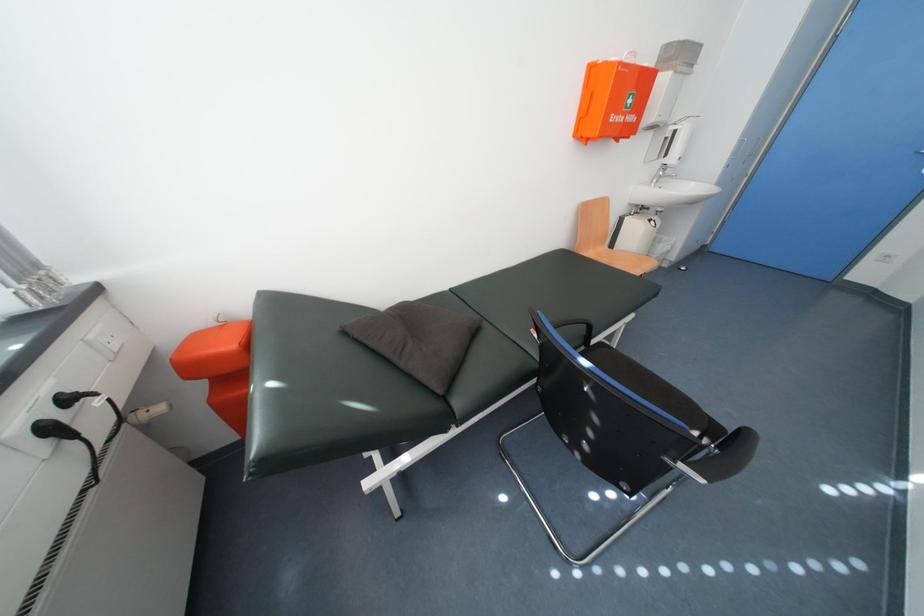
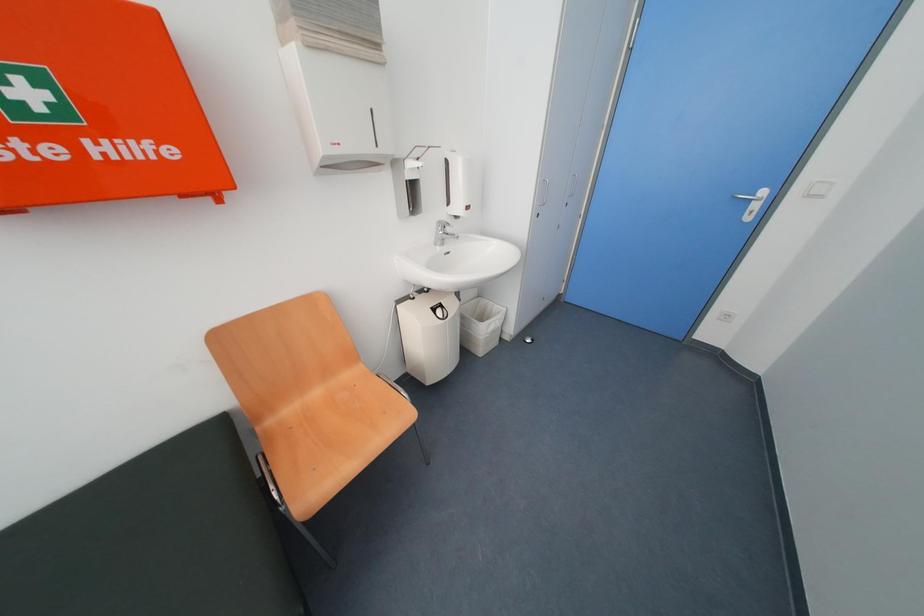
The images are taken continuously from a first-person perspective. In which direction are you moving?

The movement direction of the cameraman is right, forward.